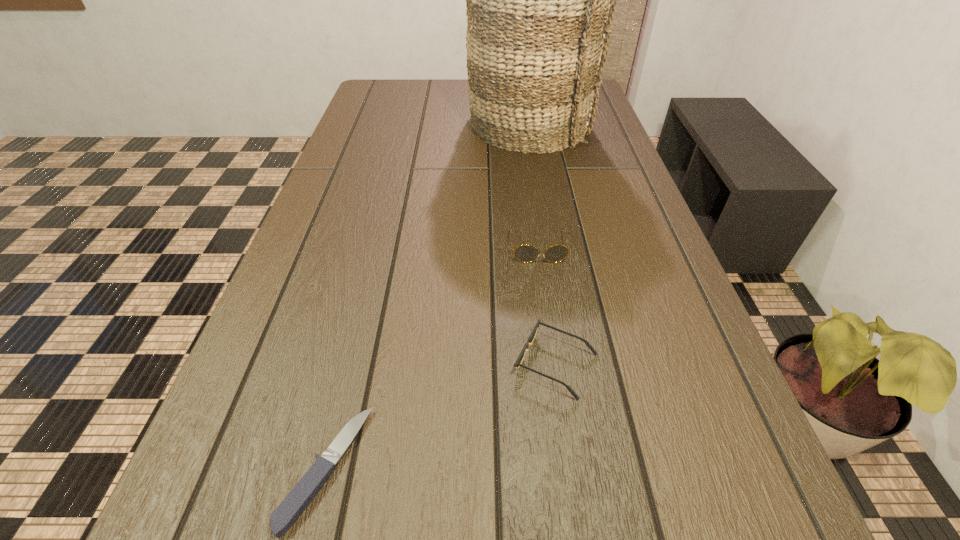
The height and width of the screenshot is (540, 960). In order to click on vacant region located 0.050m on the lenses of the second shortest object in this screenshot , I will do 482,364.

Where is `vacant area situated on the lenses of the second shortest object`? vacant area situated on the lenses of the second shortest object is located at coordinates (378, 364).

This screenshot has height=540, width=960. Identify the location of free space located on the lenses of the second shortest object. (342, 364).

Locate an element on the screen. The height and width of the screenshot is (540, 960). vacant space located on the right of the shortest object is located at coordinates (545, 468).

The image size is (960, 540). In order to click on object situated at the far edge in this screenshot , I will do `click(540, 0)`.

The width and height of the screenshot is (960, 540). Find the location of `object that is at the left edge`. object that is at the left edge is located at coordinates (299, 498).

I want to click on object that is at the right edge, so click(x=540, y=0).

You are a GUI agent. You are given a task and a screenshot of the screen. Output one action in this format:
    pyautogui.click(x=<x>, y=<y>)
    Task: Click on the object present at the far right corner
    This screenshot has height=540, width=960.
    Given the screenshot: What is the action you would take?
    pyautogui.click(x=540, y=0)

Locate an element on the screen. This screenshot has width=960, height=540. free space at the far edge of the desktop is located at coordinates (413, 105).

In the image, there is a desktop. Where is `vacant space at the left edge`? This screenshot has width=960, height=540. vacant space at the left edge is located at coordinates (375, 149).